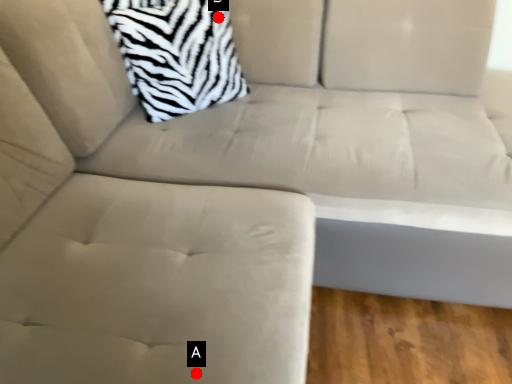
Question: Two points are circled on the image, labeled by A and B beside each circle. Which point is closer to the camera taking this photo?

Choices:
 (A) A is closer
 (B) B is closer

Answer: (A)